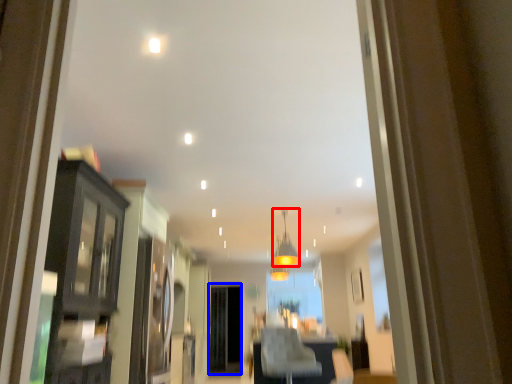
Question: Which point is closer to the camera, light fixture (highlighted by a red box) or screen door (highlighted by a blue box)?

Choices:
 (A) light fixture
 (B) screen door

Answer: (A)